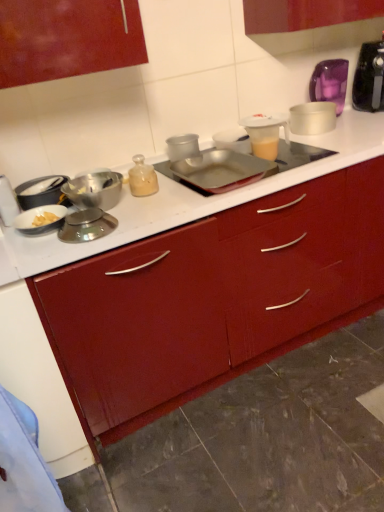
Where is `free space on the front side of purple glass jar at upper right, arranged as the second appliance when viewed from the left`? The width and height of the screenshot is (384, 512). free space on the front side of purple glass jar at upper right, arranged as the second appliance when viewed from the left is located at coordinates click(354, 123).